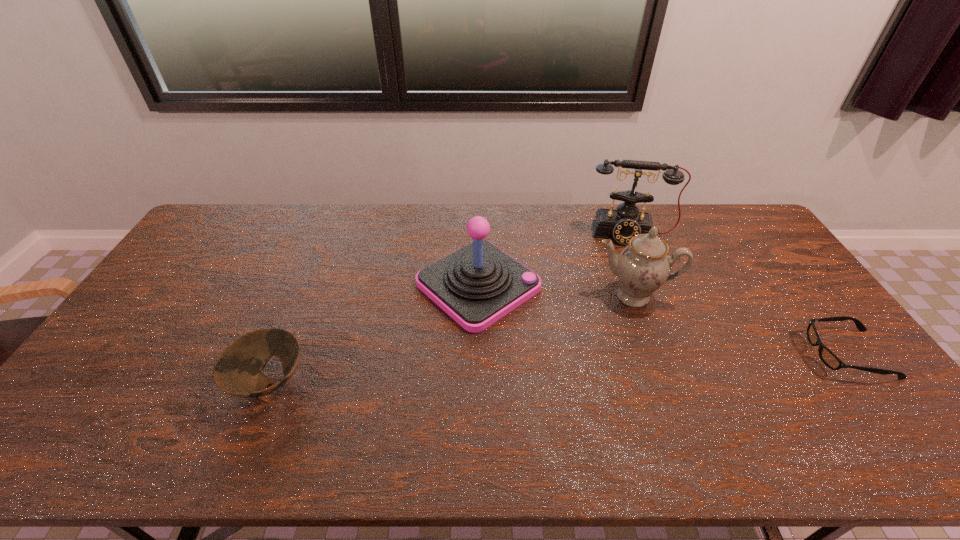
What are the coordinates of `vacant region located on the front-facing side of the shortest object` in the screenshot? It's located at (775, 354).

What are the coordinates of `free space located 0.260m forward from the base of the fourth object from right to left` in the screenshot? It's located at (594, 376).

Where is `blank space located forward from the base of the fourth object from right to left`? The width and height of the screenshot is (960, 540). blank space located forward from the base of the fourth object from right to left is located at coordinates (562, 350).

The image size is (960, 540). I want to click on free location located 0.380m forward from the base of the fourth object from right to left, so click(x=634, y=407).

Locate an element on the screen. free location located 0.270m on the dial of the telephone is located at coordinates (634, 302).

Identify the location of free space located on the dial of the telephone. The height and width of the screenshot is (540, 960). (629, 260).

The image size is (960, 540). Find the location of `vacant space located on the dial of the telephone`. vacant space located on the dial of the telephone is located at coordinates (631, 280).

I want to click on vacant area located on the spout of the chinaware, so click(631, 353).

Find the location of `vacant space located on the spout of the chinaware`. vacant space located on the spout of the chinaware is located at coordinates (631, 359).

Locate an element on the screen. free space located on the spout of the chinaware is located at coordinates (631, 350).